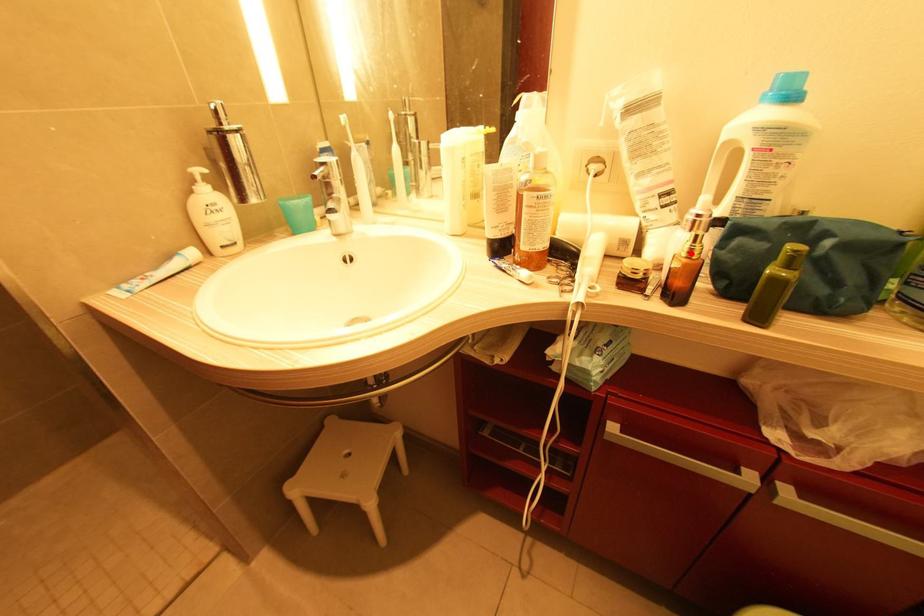
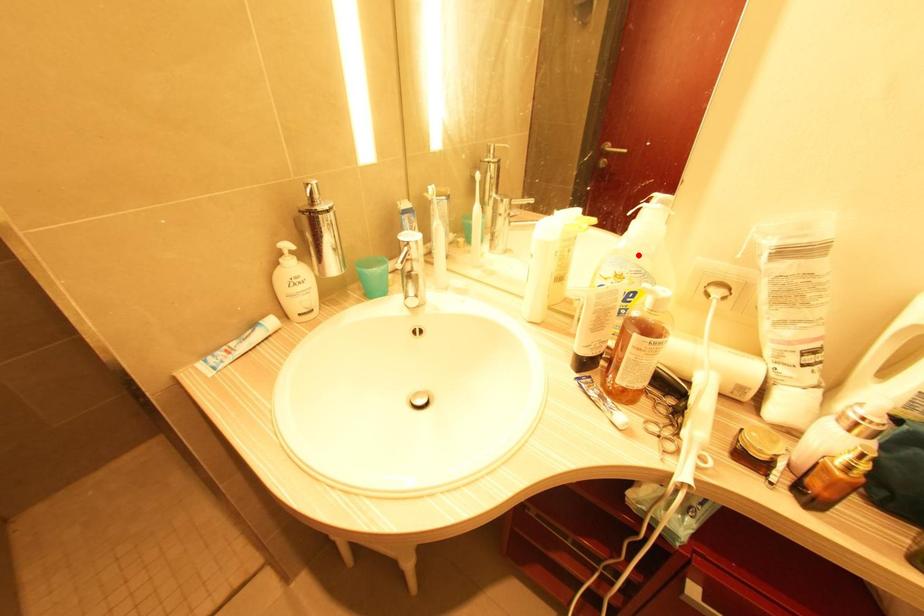
I am providing you with two images of the same scene from different viewpoints. A red point is marked on the first image and another point is marked on the second image. Is the red point in image1 aligned with the point shown in image2?

No